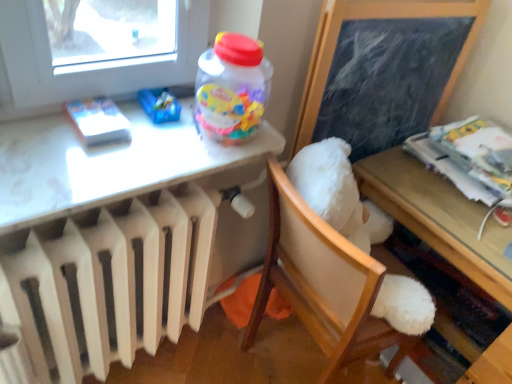
I want to click on free point above black chalkboard at upper right (from a real-world perspective), so click(x=399, y=0).